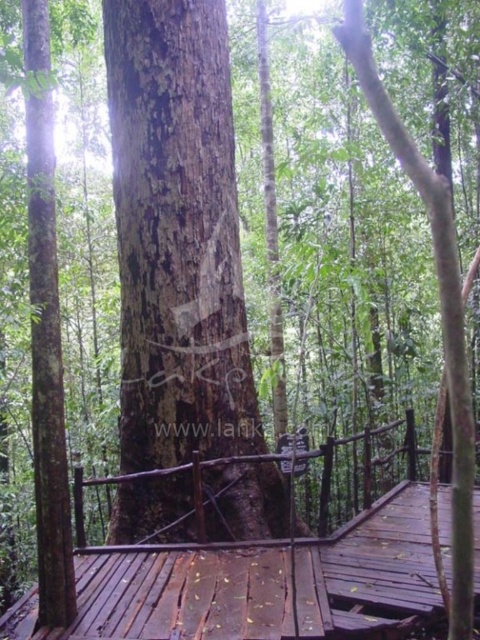
Is the position of dark brown rough bark tree trunk at center more distant than that of brown wooden bridge at center?

Yes, it is.

Describe the element at coordinates (177, 236) in the screenshot. I see `dark brown rough bark tree trunk at center` at that location.

Is point (142, 81) positioned in front of point (271, 612)?

That is False.

This screenshot has height=640, width=480. Identify the location of dark brown rough bark tree trunk at center. (177, 236).

Between dark brown rough bark tree trunk at center and brown rough tree trunk at center, which one appears on the left side from the viewer's perspective?

Positioned to the left is dark brown rough bark tree trunk at center.

In the scene shown: Is dark brown rough bark tree trunk at center to the left of brown rough tree trunk at center from the viewer's perspective?

Indeed, dark brown rough bark tree trunk at center is positioned on the left side of brown rough tree trunk at center.

Is point (144, 120) closer to camera compared to point (442, 232)?

No, it is behind (442, 232).

Where is `dark brown rough bark tree trunk at center`? The width and height of the screenshot is (480, 640). dark brown rough bark tree trunk at center is located at coordinates (177, 236).

Looking at this image, is brown wooden bridge at center below brown rough tree trunk at center?

Indeed, brown wooden bridge at center is positioned under brown rough tree trunk at center.

Identify the location of brown wooden bridge at center. (256, 582).

Locate an element on the screen. This screenshot has height=640, width=480. brown wooden bridge at center is located at coordinates (256, 582).